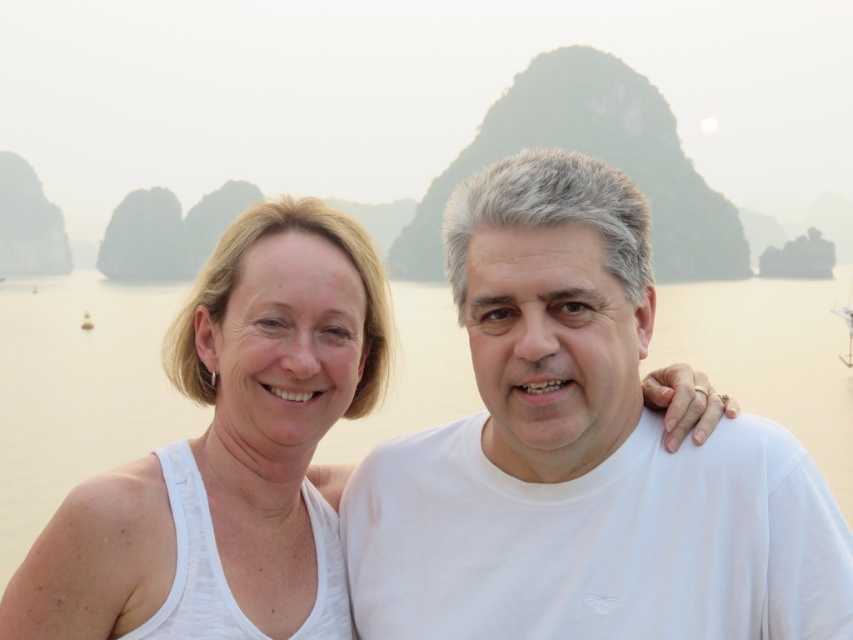
Can you confirm if white cotton t-shirt at center is taller than white cotton tank top at left?

Yes.

Measure the distance from white cotton t-shirt at center to white cotton tank top at left.

white cotton t-shirt at center is 6.18 meters from white cotton tank top at left.

Describe the element at coordinates (581, 456) in the screenshot. This screenshot has width=853, height=640. I see `white cotton t-shirt at center` at that location.

Locate an element on the screen. white cotton t-shirt at center is located at coordinates (581, 456).